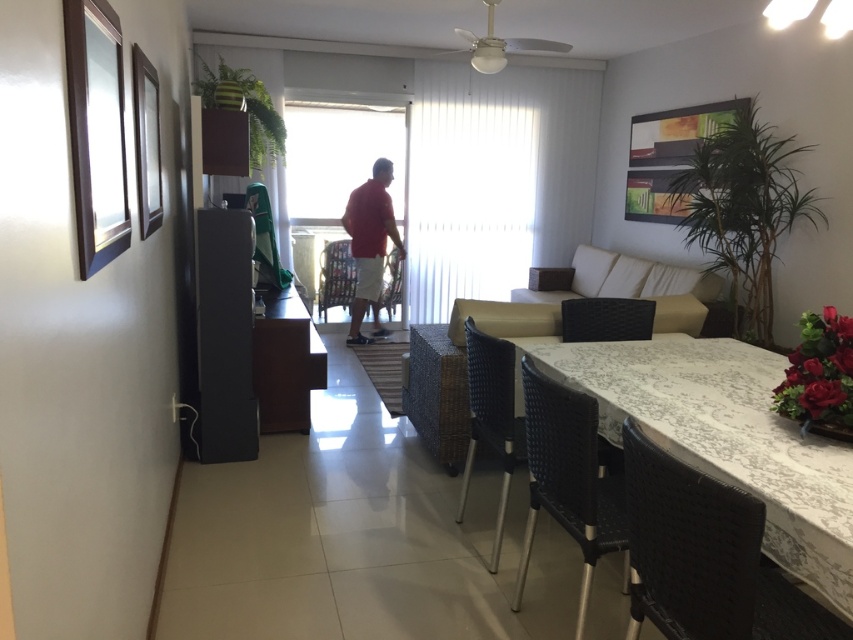
You are hosting a dinner party and need to seat a guest at the white textured table at lower right. The guest is currently standing near the matte black chair at center. Can they move directly to the table without needing to go around any obstacles?

The white textured table at lower right is positioned on the right side of the matte black chair at center, so the guest can move directly to the table from the matte black chair at center without needing to go around obstacles.